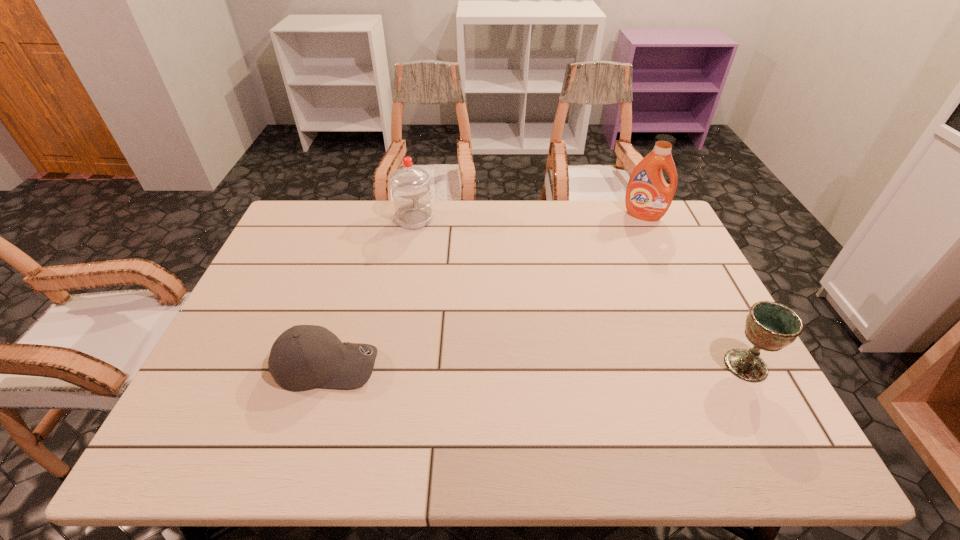
The width and height of the screenshot is (960, 540). I want to click on the shortest object, so click(304, 357).

The width and height of the screenshot is (960, 540). In order to click on the third tallest object in this screenshot , I will do `click(770, 326)`.

This screenshot has width=960, height=540. In order to click on water bottle in this screenshot , I will do `click(411, 193)`.

This screenshot has width=960, height=540. I want to click on detergent, so click(x=648, y=197).

Find the location of a particular element. The height and width of the screenshot is (540, 960). vacant region located on the front brim of the shortest object is located at coordinates (512, 365).

Where is `free space located 0.240m on the back of the chalice`? Image resolution: width=960 pixels, height=540 pixels. free space located 0.240m on the back of the chalice is located at coordinates (701, 281).

This screenshot has width=960, height=540. What are the coordinates of `vacant space located 0.350m on the handle side of the water bottle` in the screenshot? It's located at (454, 302).

Find the location of `vacant space situated 0.290m on the handle side of the water bottle`. vacant space situated 0.290m on the handle side of the water bottle is located at coordinates (447, 287).

This screenshot has height=540, width=960. Find the location of `free region located 0.390m on the handle side of the water bottle`. free region located 0.390m on the handle side of the water bottle is located at coordinates (459, 312).

Image resolution: width=960 pixels, height=540 pixels. What are the coordinates of `free space located 0.140m on the front-facing side of the tallest object` in the screenshot? It's located at (628, 246).